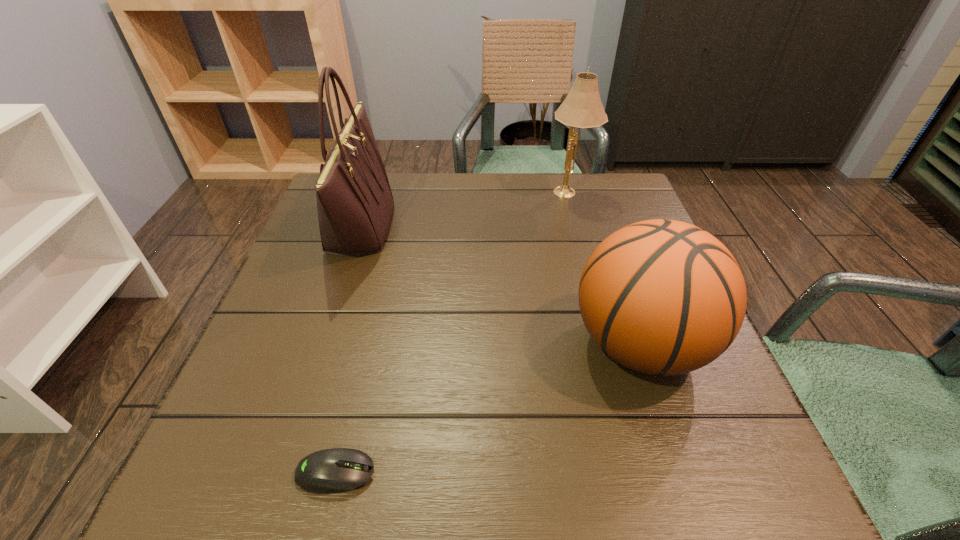
Identify the location of free space at the far edge of the desktop. (399, 212).

I want to click on vacant space at the near edge of the desktop, so click(610, 481).

In order to click on vacant space at the left edge of the desktop in this screenshot , I will do `click(320, 369)`.

This screenshot has height=540, width=960. Find the location of `blank area at the near left corner`. blank area at the near left corner is located at coordinates (205, 454).

Locate an element on the screen. The image size is (960, 540). vacant space at the far right corner of the desktop is located at coordinates (585, 200).

Where is `free space at the near right corner`? free space at the near right corner is located at coordinates (769, 489).

At what (x,y) coordinates should I click in order to perform the action: click on unoccupied area between the third farthest object and the handbag. Please return your answer as a coordinate pair (x, y). The width and height of the screenshot is (960, 540). Looking at the image, I should click on (500, 285).

Locate an element on the screen. free space between the basketball and the handbag is located at coordinates (500, 285).

Find the location of a particular element. This screenshot has height=540, width=960. vacant area between the handbag and the basketball is located at coordinates (500, 285).

Find the location of a particular element. Image resolution: width=960 pixels, height=540 pixels. free space between the nearest object and the lampshade is located at coordinates click(452, 333).